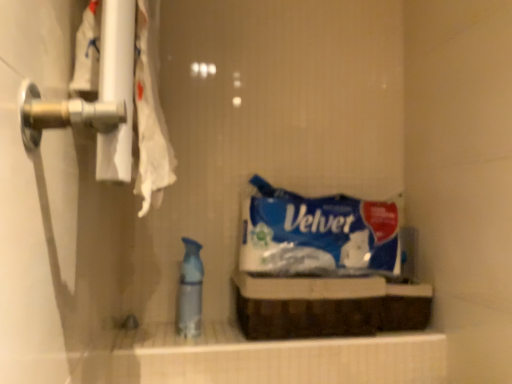
Question: Does blue paper towel at center have a greater height compared to translucent plastic spray bottle at center?

Choices:
 (A) yes
 (B) no

Answer: (B)

Question: Does blue paper towel at center come behind translucent plastic spray bottle at center?

Choices:
 (A) no
 (B) yes

Answer: (B)

Question: Does blue paper towel at center contain translucent plastic spray bottle at center?

Choices:
 (A) yes
 (B) no

Answer: (B)

Question: Considering the relative sizes of blue paper towel at center and translucent plastic spray bottle at center in the image provided, is blue paper towel at center wider than translucent plastic spray bottle at center?

Choices:
 (A) yes
 (B) no

Answer: (A)

Question: From the image's perspective, is blue paper towel at center on translucent plastic spray bottle at center?

Choices:
 (A) no
 (B) yes

Answer: (B)

Question: Does blue paper towel at center have a lesser height compared to translucent plastic spray bottle at center?

Choices:
 (A) no
 (B) yes

Answer: (B)

Question: Are translucent plastic spray bottle at center and blue paper towel at center beside each other?

Choices:
 (A) yes
 (B) no

Answer: (B)

Question: From the image's perspective, would you say translucent plastic spray bottle at center is shown under blue paper towel at center?

Choices:
 (A) yes
 (B) no

Answer: (A)

Question: Is translucent plastic spray bottle at center closer to the viewer compared to blue paper towel at center?

Choices:
 (A) no
 (B) yes

Answer: (B)

Question: From the image's perspective, is translucent plastic spray bottle at center on blue paper towel at center?

Choices:
 (A) no
 (B) yes

Answer: (A)

Question: From a real-world perspective, is translucent plastic spray bottle at center physically below blue paper towel at center?

Choices:
 (A) no
 (B) yes

Answer: (B)

Question: Is translucent plastic spray bottle at center outside of blue paper towel at center?

Choices:
 (A) no
 (B) yes

Answer: (B)

Question: Is point (339, 228) positioned closer to the camera than point (193, 264)?

Choices:
 (A) farther
 (B) closer

Answer: (A)